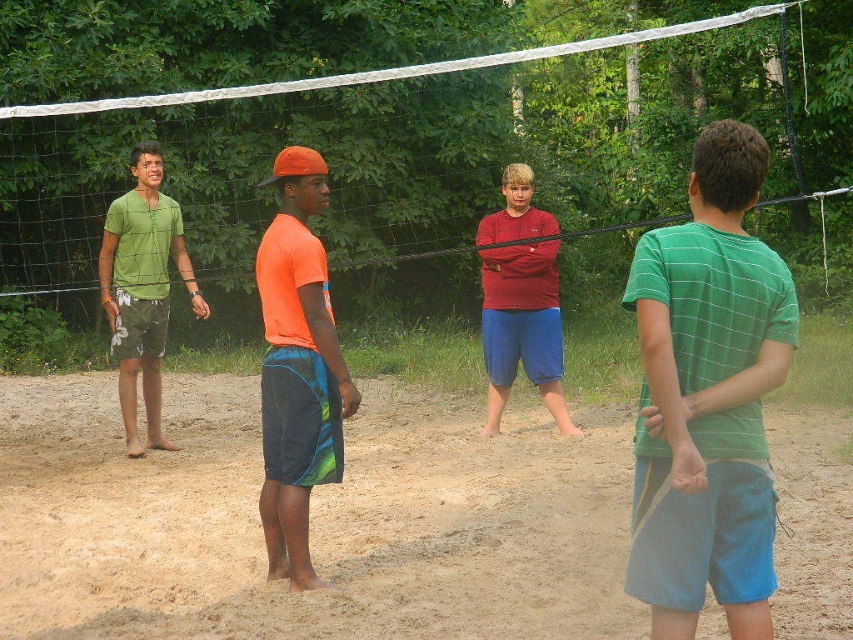
Based on the scene description, if the matte red shirt at center is part of a player, can you determine whether the white mesh net at center is above or below the player?

The white mesh net at center is above the matte red shirt at center, so the net is positioned above the player wearing the matte red shirt at center.